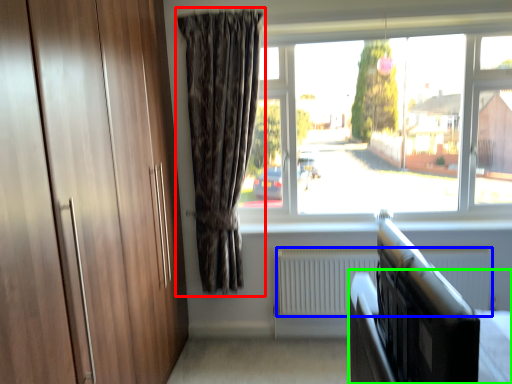
Question: Which object is the farthest from curtain (highlighted by a red box)? Choose among these: radiator (highlighted by a blue box) or bed frame (highlighted by a green box).

Choices:
 (A) radiator
 (B) bed frame

Answer: (B)